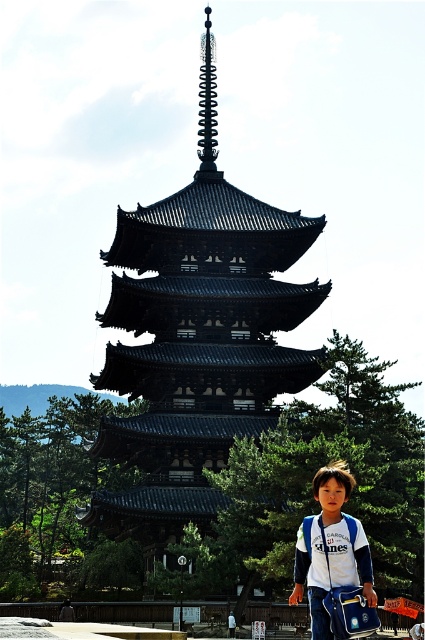
Does black wooden pagoda at center appear over white fabric backpack at lower center?

Indeed, black wooden pagoda at center is positioned over white fabric backpack at lower center.

Based on the photo, can you confirm if black wooden pagoda at center is taller than white fabric backpack at lower center?

Yes.

Who is more forward, (207, 456) or (343, 611)?

Positioned in front is point (343, 611).

I want to click on black wooden pagoda at center, so click(197, 339).